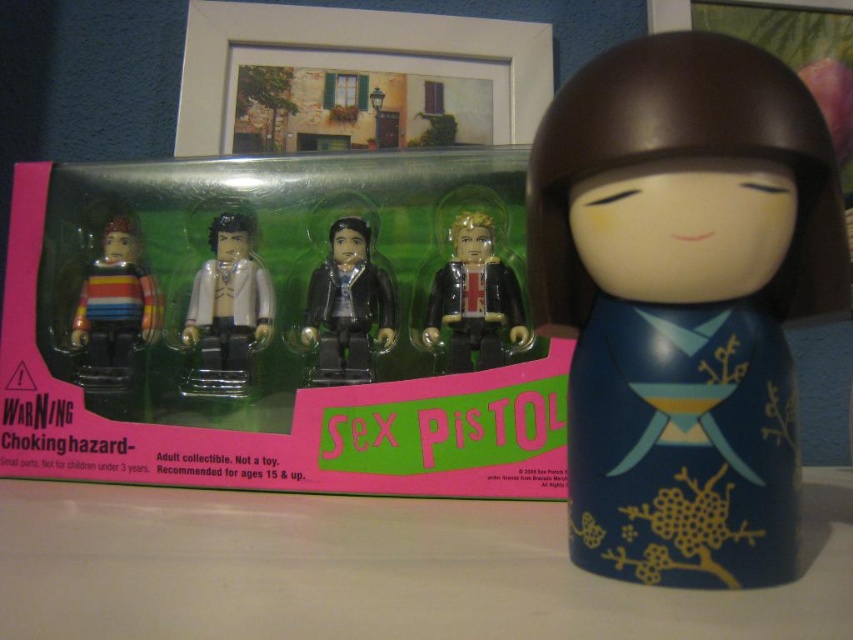
Consider the image. You are arranging items on a shelf and need to place the white matte minifigure at center and the black matte figure at center. Based on their positions in the image, which one should you place first to maintain the correct order?

The white matte minifigure at center is to the left of the black matte figure at center, so you should place the white matte minifigure at center first to maintain the correct order from left to right.

You are organizing a display and need to place a new item between the white matte minifigure at center and the shiny gold minifigure at center. Which minifigure should you place the new item closer to so it doesn

The white matte minifigure at center is closer to you than the shiny gold minifigure at center, so you should place the new item closer to the white matte minifigure at center to maintain proper spacing between all items.

You are organizing a display and need to place the blue glossy doll at center and the striped fabric figure at left on a shelf. Given their sizes, which one should you place first to ensure stability?

The blue glossy doll at center is taller than the striped fabric figure at left, so you should place the taller doll first to ensure stability by positioning it at the back of the shelf.